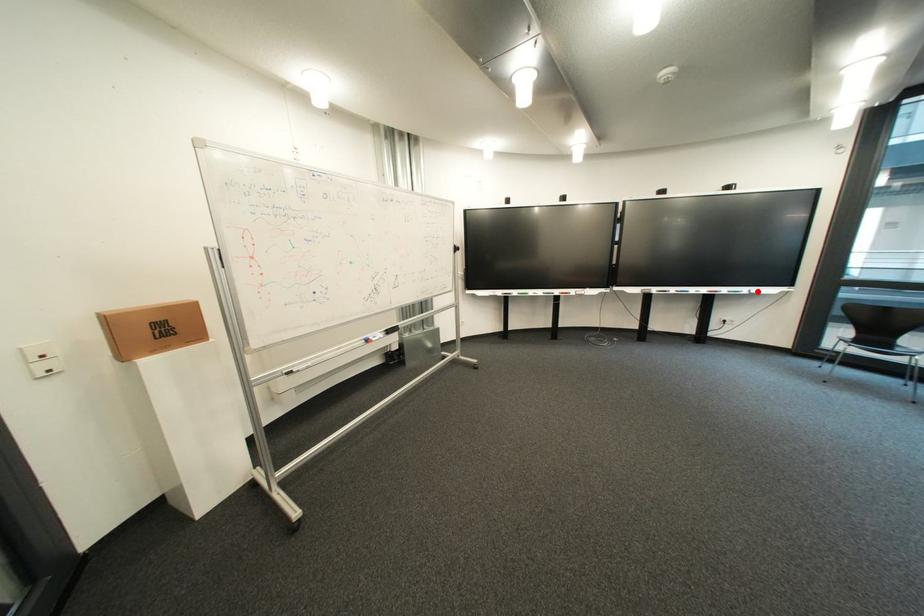
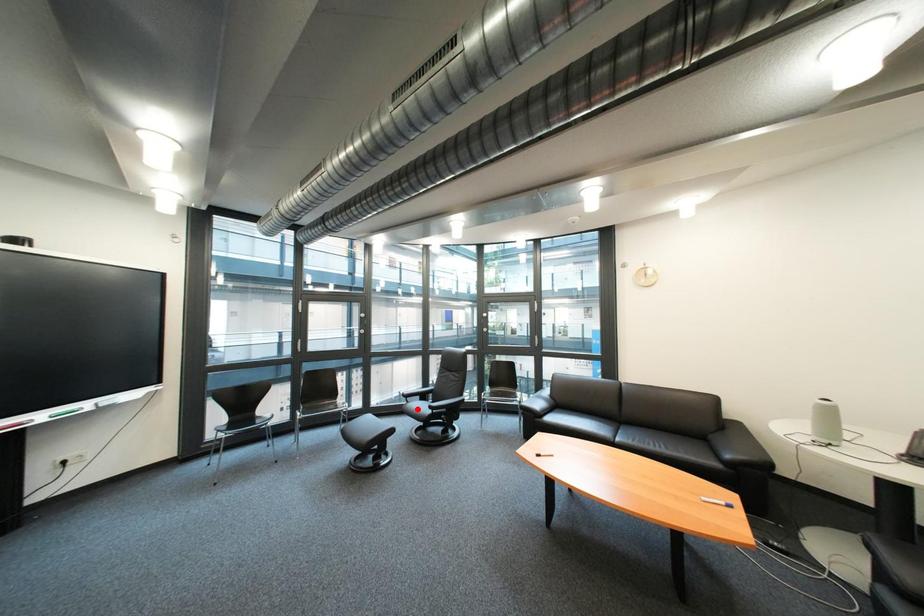
I am providing you with two images of the same scene from different viewpoints. A red point is marked on the first image and another point is marked on the second image. Are the points marked in image1 and image2 representing the same 3D position?

No